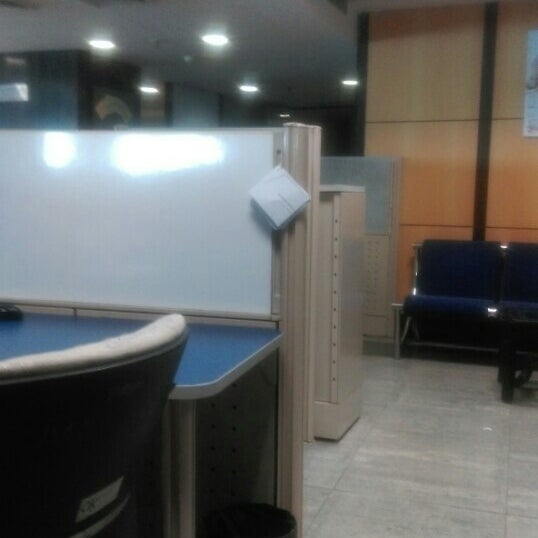
This screenshot has width=538, height=538. Find the location of `chairs`. chairs is located at coordinates (457, 301).